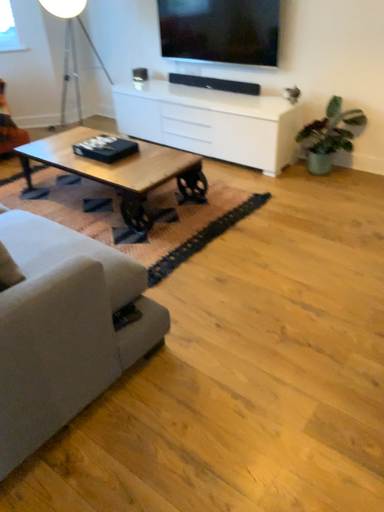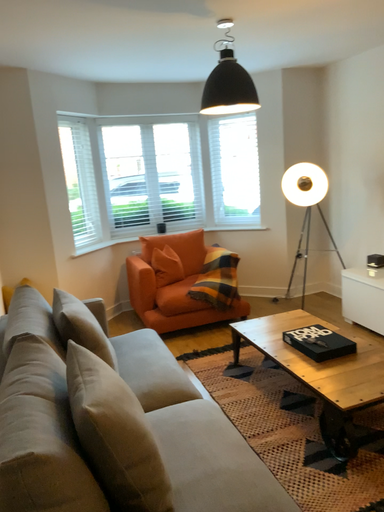
Question: Which way did the camera rotate in the video?

Choices:
 (A) rotated downward
 (B) rotated upward

Answer: (B)